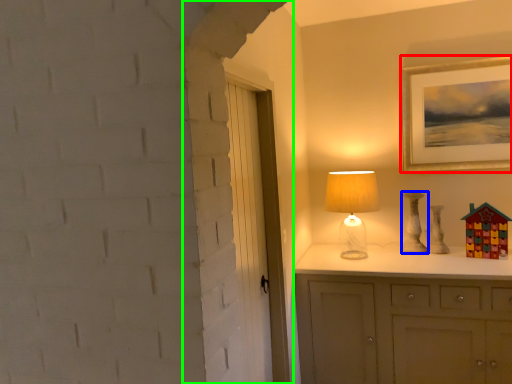
Question: Which is nearer to the picture frame (highlighted by a red box)? lamp (highlighted by a blue box) or door (highlighted by a green box).

Choices:
 (A) lamp
 (B) door

Answer: (A)